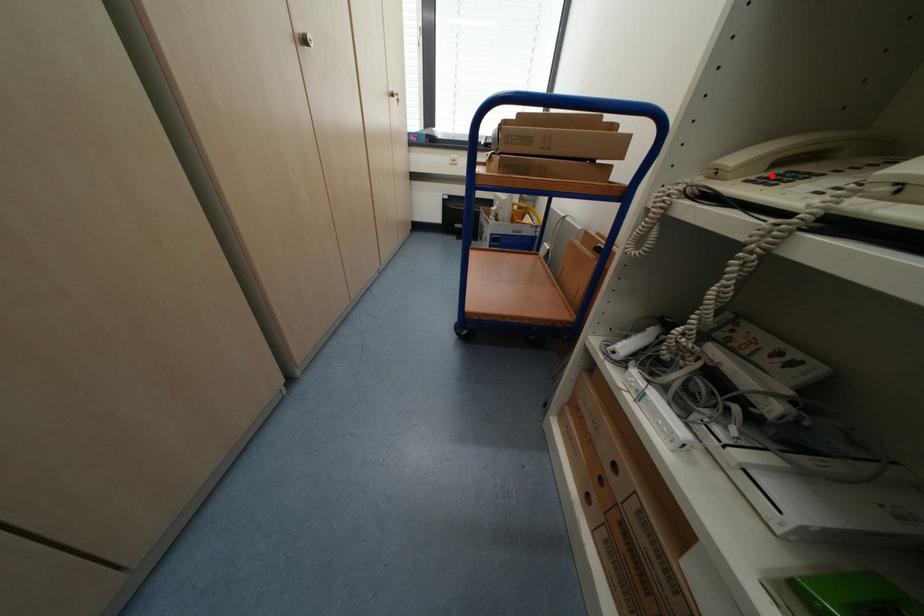
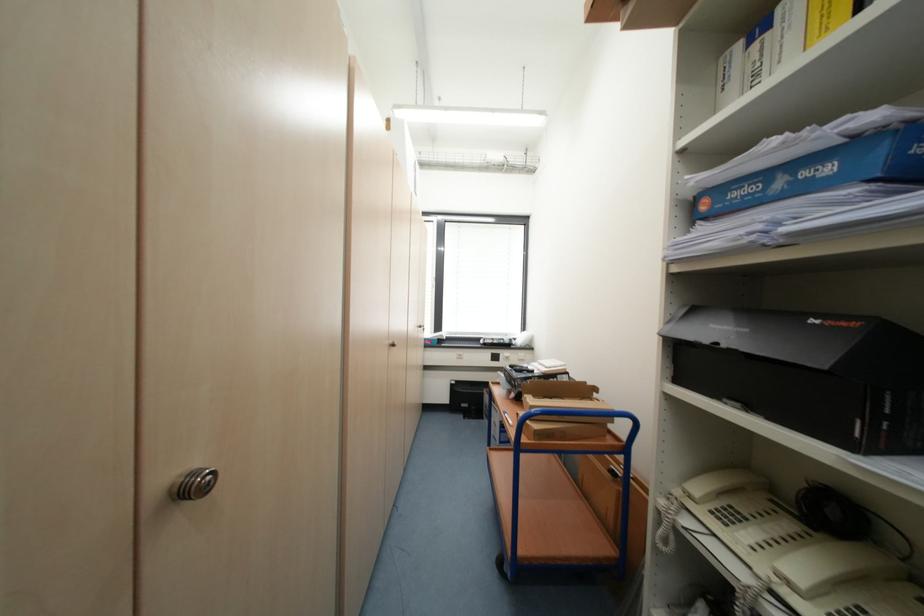
Question: I am providing you with two images of the same scene from different viewpoints. A red point is marked on the first image. At the location where the point appears in image 1, is it still visible in image 2?

Choices:
 (A) Yes
 (B) No

Answer: (A)